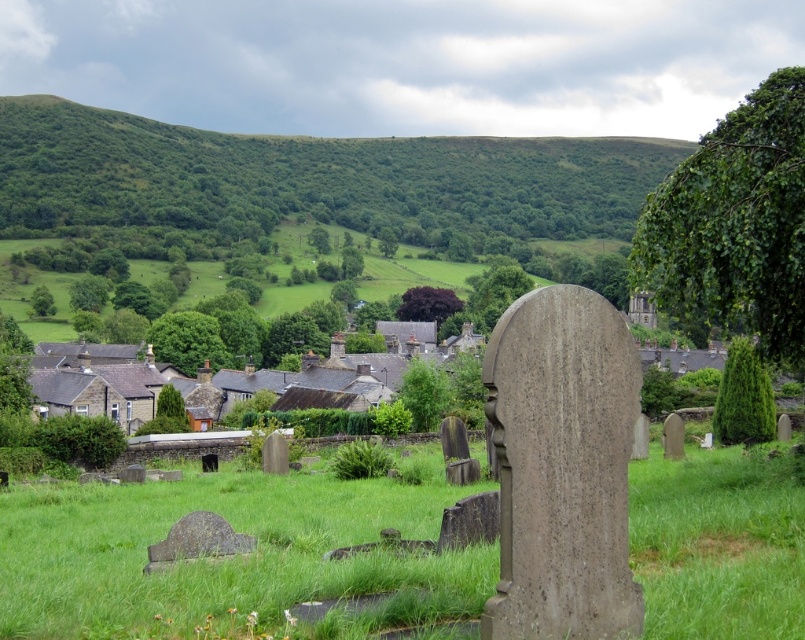
Can you confirm if green leafy hillside at upper center is smaller than green leafy tree at center?

No.

Is point (523, 154) more distant than point (180, 317)?

Yes, point (523, 154) is behind point (180, 317).

At what (x,y) coordinates should I click in order to perform the action: click on green leafy hillside at upper center. Please return your answer as a coordinate pair (x, y). This screenshot has height=640, width=805. Looking at the image, I should click on (312, 179).

Between green leafy hillside at upper center and green textured tree at right, which one is positioned lower?

green textured tree at right is lower down.

What do you see at coordinates (312, 179) in the screenshot? This screenshot has width=805, height=640. I see `green leafy hillside at upper center` at bounding box center [312, 179].

You are a GUI agent. You are given a task and a screenshot of the screen. Output one action in this format:
    pyautogui.click(x=<x>, y=<y>)
    Task: Click on the green leafy hillside at upper center
    The height and width of the screenshot is (640, 805).
    Given the screenshot: What is the action you would take?
    pyautogui.click(x=312, y=179)

Is green leafy branch at upper right shorter than green leafy tree at center?

Incorrect, green leafy branch at upper right's height does not fall short of green leafy tree at center's.

Is the position of green leafy branch at upper right more distant than that of green leafy tree at center?

That is False.

Who is more distant from viewer, [770,285] or [184,332]?

The point [184,332] is more distant.

Identify the location of green leafy branch at upper right. (735, 225).